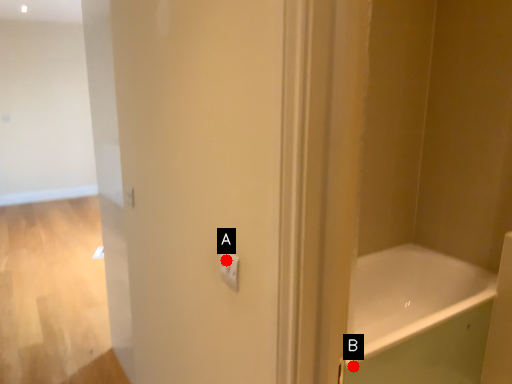
Question: Two points are circled on the image, labeled by A and B beside each circle. Which point appears closest to the camera in this image?

Choices:
 (A) A is closer
 (B) B is closer

Answer: (A)